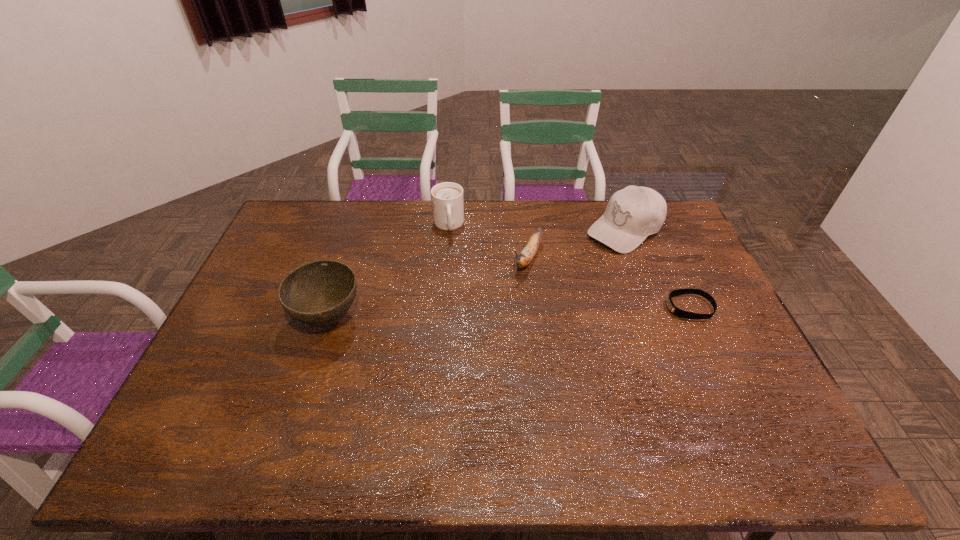
Image resolution: width=960 pixels, height=540 pixels. Find the location of `vacant area between the baseball cap and the bowl`. vacant area between the baseball cap and the bowl is located at coordinates (477, 274).

The width and height of the screenshot is (960, 540). In order to click on free spot between the wristband and the third object from left to right in this screenshot , I will do `click(608, 282)`.

Identify the location of vacant region between the leftmost object and the cappuccino. (389, 272).

The image size is (960, 540). Find the location of `vacant space that's between the cappuccino and the bowl`. vacant space that's between the cappuccino and the bowl is located at coordinates (389, 272).

This screenshot has width=960, height=540. I want to click on empty space between the second object from left to right and the leftmost object, so click(389, 272).

Image resolution: width=960 pixels, height=540 pixels. I want to click on free space between the wristband and the baseball cap, so click(658, 268).

Locate an element on the screen. free space between the third object from left to right and the baseball cap is located at coordinates (576, 244).

Find the location of `vacant area that lies between the baseball cap and the fourth tallest object`. vacant area that lies between the baseball cap and the fourth tallest object is located at coordinates (576, 244).

Identify the location of vacant space in between the banana and the baseball cap. (576, 244).

Find the location of `vacant space that is in between the third object from left to right and the bowl`. vacant space that is in between the third object from left to right and the bowl is located at coordinates (428, 288).